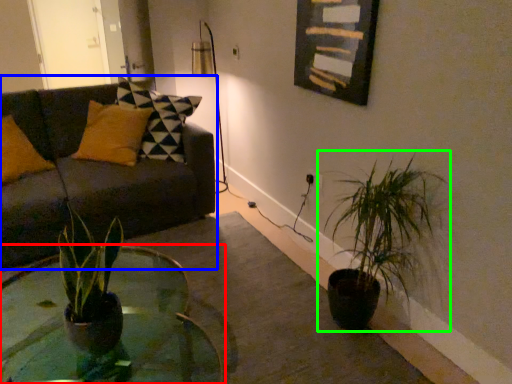
Question: Which object is the closest to the coffee table (highlighted by a red box)? Choose among these: studio couch (highlighted by a blue box) or houseplant (highlighted by a green box).

Choices:
 (A) studio couch
 (B) houseplant

Answer: (A)